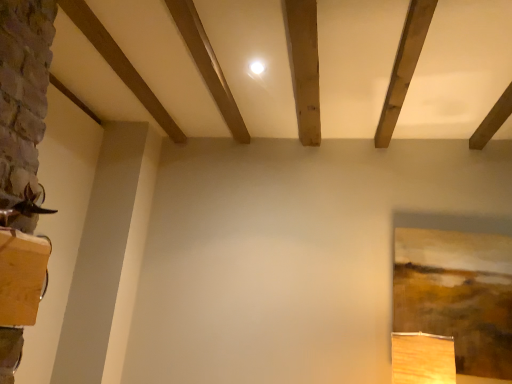
Question: Is smooth wooden plank at upper left, marked as the 2th plank in a left-to-right arrangement, wider or thinner than wooden beam at upper left, which appears as the first plank when viewed from the left?

Choices:
 (A) wide
 (B) thin

Answer: (B)

Question: Is smooth wooden plank at upper left, the first plank in the right-to-left sequence, taller or shorter than wooden beam at upper left, which appears as the second plank when viewed from the right?

Choices:
 (A) tall
 (B) short

Answer: (B)

Question: From the image's perspective, is smooth wooden plank at upper left, the first plank in the right-to-left sequence, located above or below wooden beam at upper left, which appears as the first plank when viewed from the left?

Choices:
 (A) below
 (B) above

Answer: (A)

Question: Looking at the image, does wooden beam at upper left, which appears as the second plank when viewed from the right, seem bigger or smaller compared to smooth wooden plank at upper left, the first plank in the right-to-left sequence?

Choices:
 (A) big
 (B) small

Answer: (A)

Question: Is point (180, 130) closer or farther from the camera than point (184, 13)?

Choices:
 (A) farther
 (B) closer

Answer: (A)

Question: In terms of height, does wooden beam at upper left, which appears as the first plank when viewed from the left, look taller or shorter compared to smooth wooden plank at upper left, the first plank in the right-to-left sequence?

Choices:
 (A) tall
 (B) short

Answer: (A)

Question: Do you think wooden beam at upper left, which appears as the second plank when viewed from the right, is within smooth wooden plank at upper left, the first plank in the right-to-left sequence, or outside of it?

Choices:
 (A) outside
 (B) inside

Answer: (A)